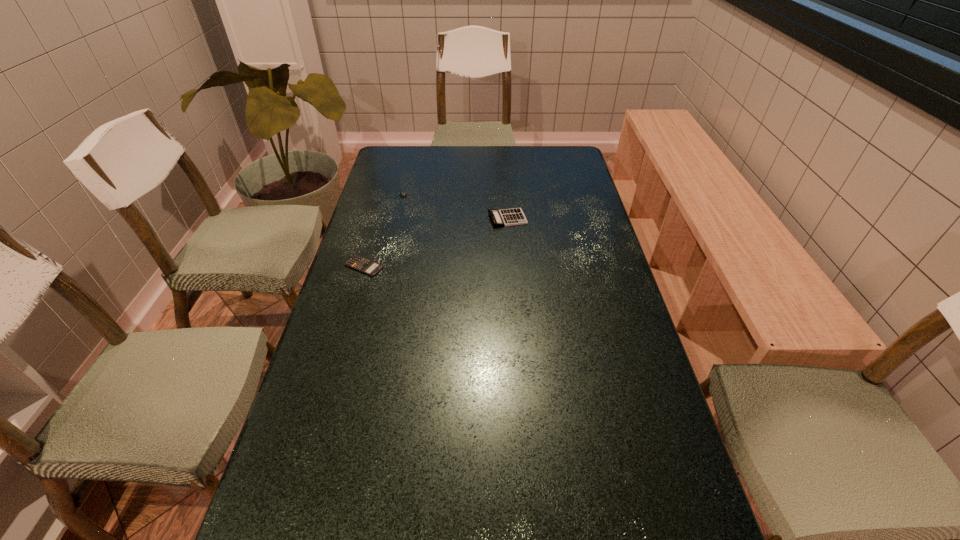
Identify the location of the second farthest object. The image size is (960, 540). (507, 217).

Identify the location of the farther calculator. The image size is (960, 540). (507, 217).

You are a GUI agent. You are given a task and a screenshot of the screen. Output one action in this format:
    pyautogui.click(x=<x>, y=<y>)
    Task: Click on the farthest object
    
    Given the screenshot: What is the action you would take?
    click(402, 193)

Locate an element on the screen. The height and width of the screenshot is (540, 960). mouse is located at coordinates click(x=402, y=193).

Image resolution: width=960 pixels, height=540 pixels. What are the coordinates of `the shortest object` in the screenshot? It's located at (357, 262).

This screenshot has width=960, height=540. Find the location of `the nearest object`. the nearest object is located at coordinates (357, 262).

Find the location of a particular element. The width and height of the screenshot is (960, 540). vacant position located 0.210m on the left of the farther calculator is located at coordinates (425, 218).

Image resolution: width=960 pixels, height=540 pixels. Find the location of `blank area located 0.070m on the left of the second tallest object`. blank area located 0.070m on the left of the second tallest object is located at coordinates (378, 198).

Find the location of a particular element. The height and width of the screenshot is (540, 960). free space located on the right of the left calculator is located at coordinates 468,266.

Find the location of a particular element. The image size is (960, 540). mouse that is positioned at the left edge is located at coordinates (402, 193).